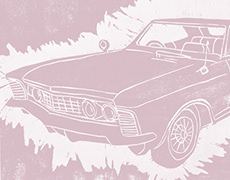
Where is `window`? The width and height of the screenshot is (230, 180). window is located at coordinates point(163,30).